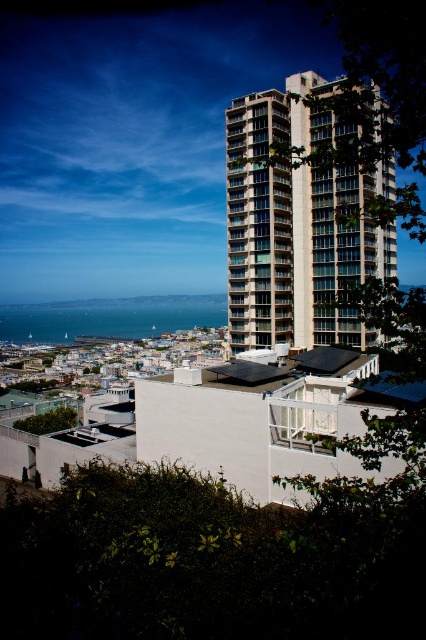
Is beige concrete building at center to the right of blue water at lower left from the viewer's perspective?

Yes, beige concrete building at center is to the right of blue water at lower left.

Identify the location of beige concrete building at center. (296, 225).